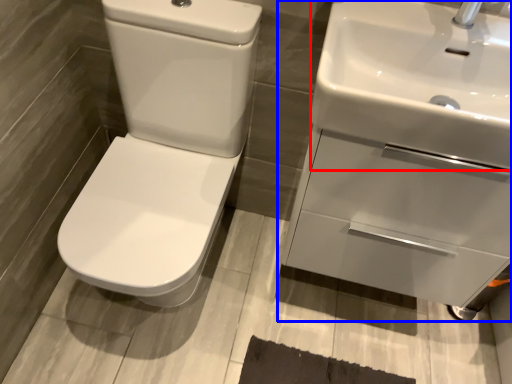
Question: Among these objects, which one is farthest to the camera, sink (highlighted by a red box) or sink (highlighted by a blue box)?

Choices:
 (A) sink
 (B) sink

Answer: (B)